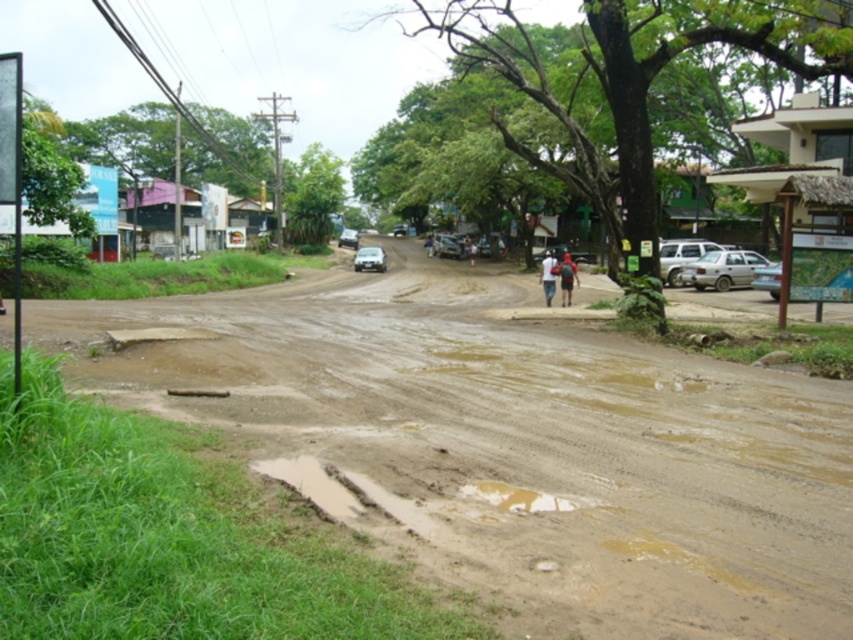
You are a pedestrian walking on the brown muddy road at center and wearing the white matte shirt at center. You want to avoid getting your shirt dirty. Which direction should you walk to stay away from the muddy road?

The brown muddy road at center is positioned on the left side of the white matte shirt at center. To avoid getting the white matte shirt at center dirty, you should walk to the right side away from the brown muddy road at center.

In the scene shown: You are a delivery person trying to navigate through the brown muddy road at center and the red fabric backpack at center. Which object is closer to you as you approach the scene?

The brown muddy road at center is closer to the viewer than the red fabric backpack at center, so the brown muddy road at center would be closer as you approach the scene.

You are a pedestrian walking on the brown muddy road at center and wearing the white matte shirt at center. Do you think your shirt will get dirty from the mud on the road?

The brown muddy road at center is positioned under the white matte shirt at center, so yes, the shirt will get dirty from the mud on the road.